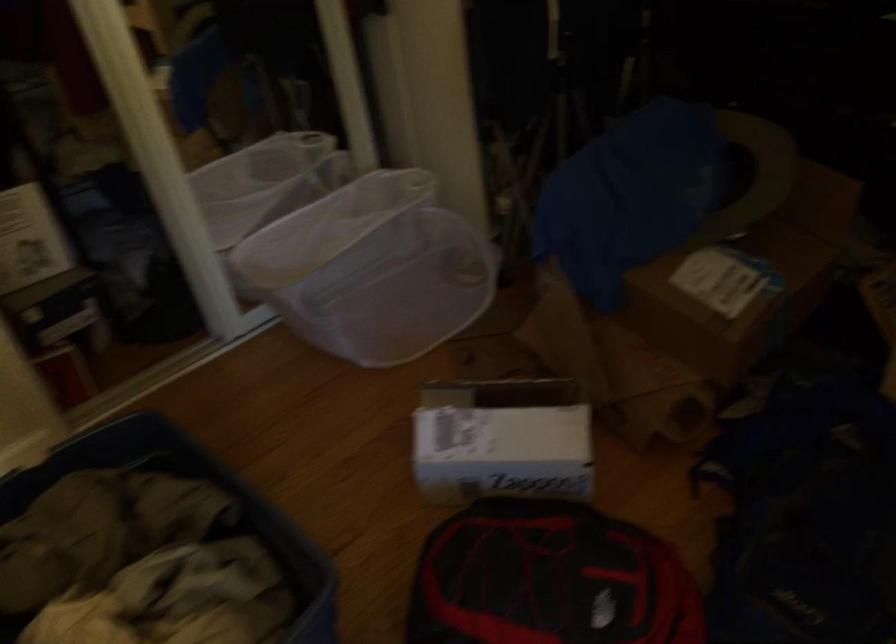
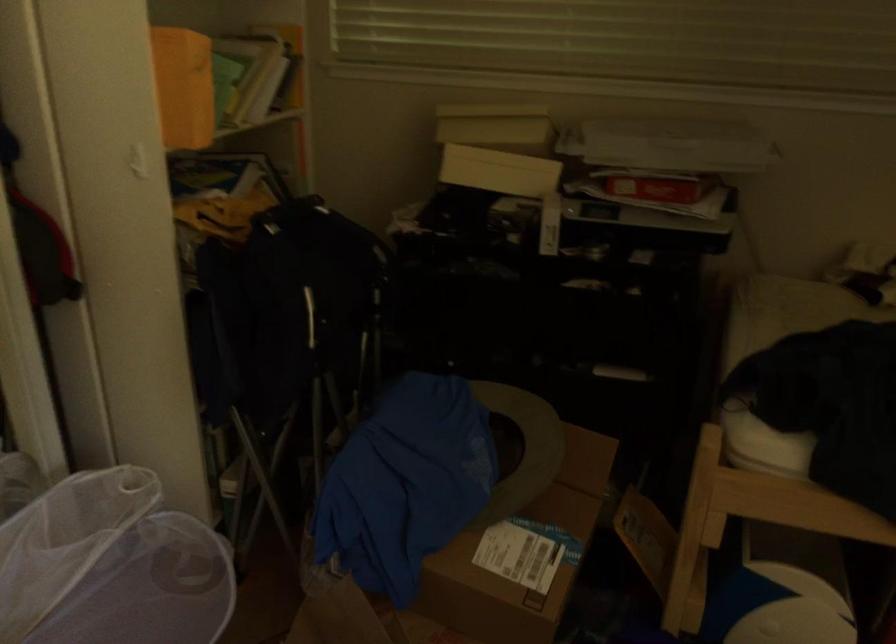
Question: The camera is either moving clockwise (left) or counter-clockwise (right) around the object. The first image is from the beginning of the video and the second image is from the end. Is the camera moving left or right when shooting the video?

Choices:
 (A) Left
 (B) Right

Answer: (A)